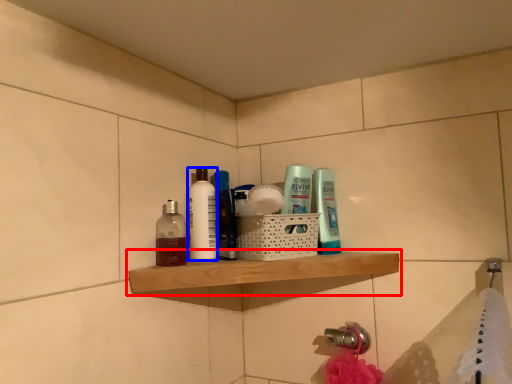
Question: Which object is further to the camera taking this photo, shelf (highlighted by a red box) or toiletry (highlighted by a blue box)?

Choices:
 (A) shelf
 (B) toiletry

Answer: (B)